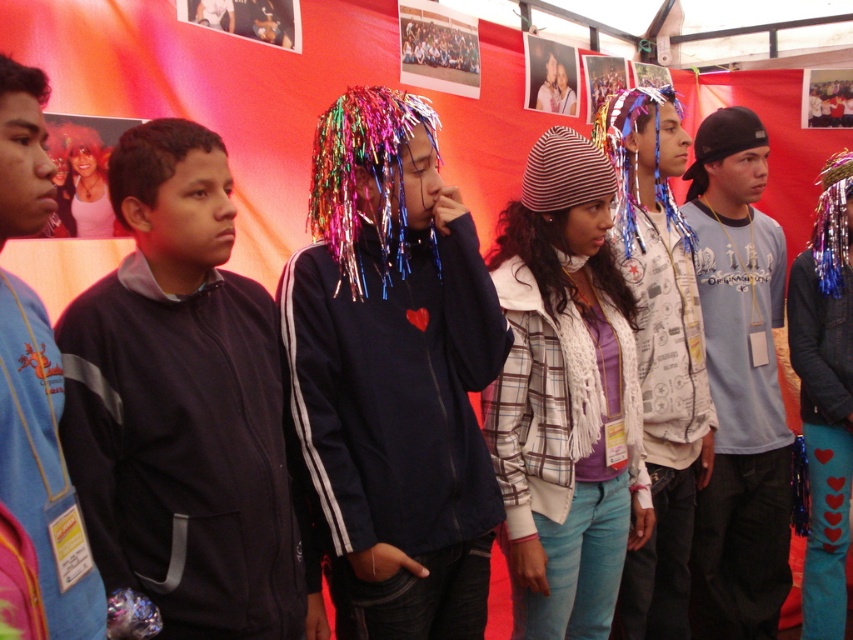
Question: Can you confirm if shiny metallic jacket at center is positioned to the left of striped knit beanie at center?

Choices:
 (A) no
 (B) yes

Answer: (B)

Question: Which object appears closest to the camera in this image?

Choices:
 (A) light blue t-shirt at center
 (B) black fleece jacket at left
 (C) shiny metallic jacket at center

Answer: (B)

Question: Does striped knit beanie at center appear over shiny metallic tinsel at center?

Choices:
 (A) no
 (B) yes

Answer: (A)

Question: Which point is farther to the camera?

Choices:
 (A) (799, 326)
 (B) (734, 401)

Answer: (A)

Question: Which object appears farthest from the camera in this image?

Choices:
 (A) black fleece jacket at left
 (B) light blue t-shirt at center

Answer: (B)

Question: Does shiny metallic jacket at center appear on the left side of light blue t-shirt at center?

Choices:
 (A) no
 (B) yes

Answer: (B)